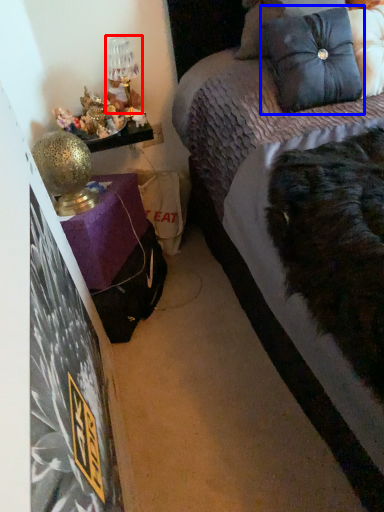
Question: Which object appears farthest to the camera in this image, table lamp (highlighted by a red box) or pillow (highlighted by a blue box)?

Choices:
 (A) table lamp
 (B) pillow

Answer: (A)